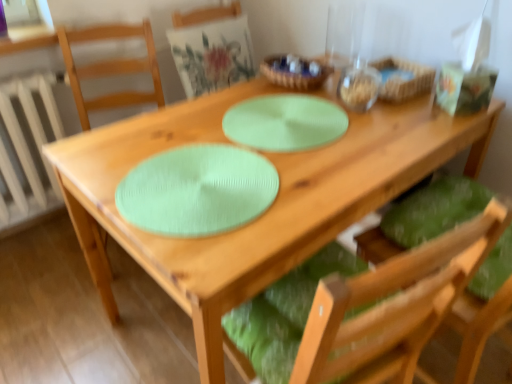
I want to click on vacant area situated below mint green textured placemat at center (from a real-world perspective), so click(194, 177).